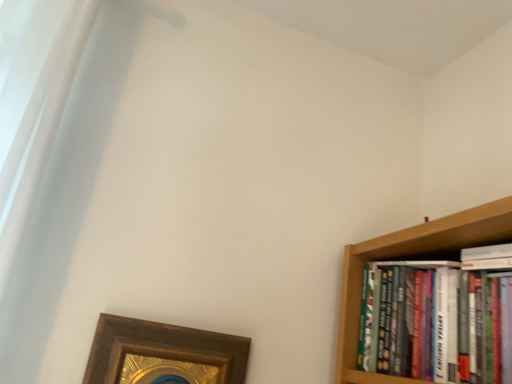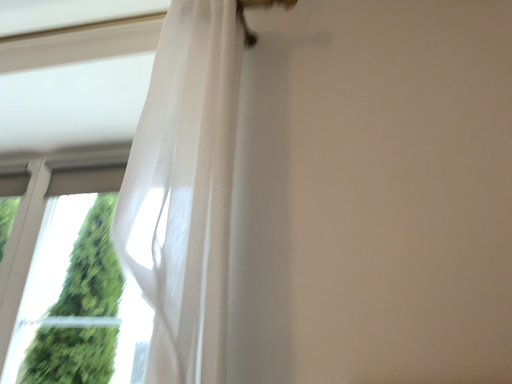
Question: Which way did the camera rotate in the video?

Choices:
 (A) rotated right
 (B) rotated left

Answer: (B)